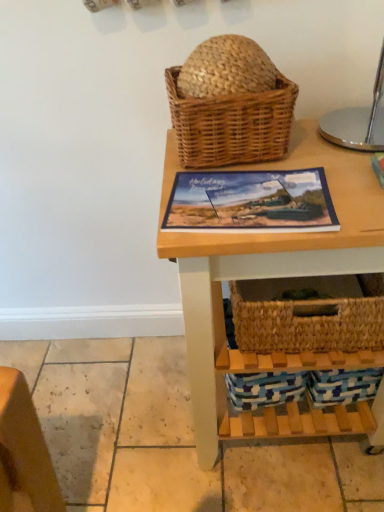
Question: Is point (187, 293) closer or farther from the camera than point (301, 172)?

Choices:
 (A) closer
 (B) farther

Answer: (A)

Question: In terms of width, does natural wood table at center look wider or thinner when compared to matte plastic picture frame at center?

Choices:
 (A) wide
 (B) thin

Answer: (A)

Question: Which object is positioned farthest from the natural wood table at center?

Choices:
 (A) woven brown picnic basket at upper center
 (B) matte plastic picture frame at center

Answer: (A)

Question: Which of these objects is positioned closest to the natural wood table at center?

Choices:
 (A) woven brown picnic basket at upper center
 (B) matte plastic picture frame at center

Answer: (B)